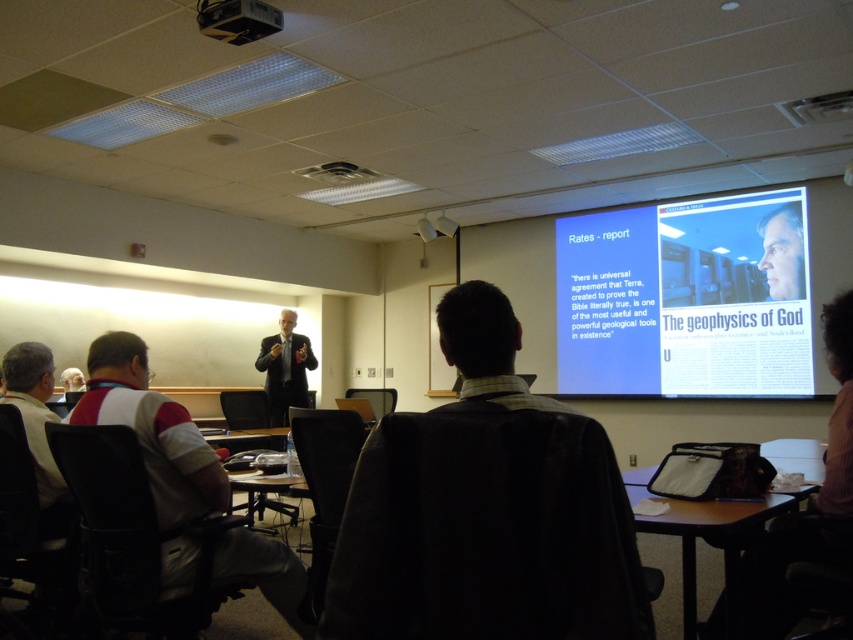
Measure the distance from dark brown leather jacket at center to dark suit at center.

18.42 feet

You are a GUI agent. You are given a task and a screenshot of the screen. Output one action in this format:
    pyautogui.click(x=<x>, y=<y>)
    Task: Click on the dark brown leather jacket at center
    This screenshot has height=640, width=853.
    Given the screenshot: What is the action you would take?
    pyautogui.click(x=486, y=508)

Who is more distant from viewer, [379,456] or [297,378]?

The point [297,378] is behind.

You are a GUI agent. You are given a task and a screenshot of the screen. Output one action in this format:
    pyautogui.click(x=<x>, y=<y>)
    Task: Click on the dark brown leather jacket at center
    The image size is (853, 640).
    Given the screenshot: What is the action you would take?
    pyautogui.click(x=486, y=508)

Is point (788, 248) behind point (109, 419)?

Yes, point (788, 248) is farther from viewer.

In the scene shown: Can you confirm if white glossy screen at upper right is taller than gray fabric shirt at left?

Correct, white glossy screen at upper right is much taller as gray fabric shirt at left.

Is point (590, 326) positioned after point (96, 380)?

Yes, point (590, 326) is behind point (96, 380).

Where is `white glossy screen at upper right`? white glossy screen at upper right is located at coordinates (686, 298).

Can you confirm if gray fabric shirt at left is positioned to the right of dark suit at center?

Yes, gray fabric shirt at left is to the right of dark suit at center.

Which is behind, point (102, 349) or point (299, 380)?

The point (299, 380) is more distant.

Locate an element on the screen. This screenshot has height=640, width=853. gray fabric shirt at left is located at coordinates (152, 429).